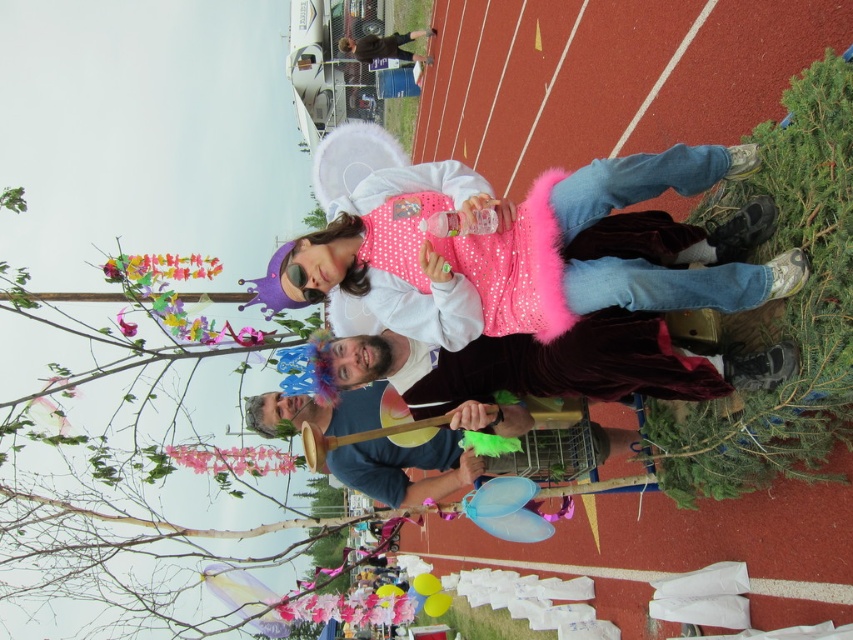
You are standing at the point marked as point (x=515, y=250) and want to walk to the other side of the sports field. The red running track and white lane markings are 149.85 feet away from your current position. Can you estimate how far you need to walk to reach the track?

The distance between you and the red running track and white lane markings is 149.85 feet, so you need to walk approximately 149.85 feet to reach them.

You are a photographer at the event and want to capture a photo where the pink fluffy tutu at center and the velvet maroon cape at center are both visible. Based on their positions, which one should you focus on to ensure both are in the frame?

The pink fluffy tutu at center is above the velvet maroon cape at center, so focusing on the pink fluffy tutu at center will ensure both are visible in the frame.